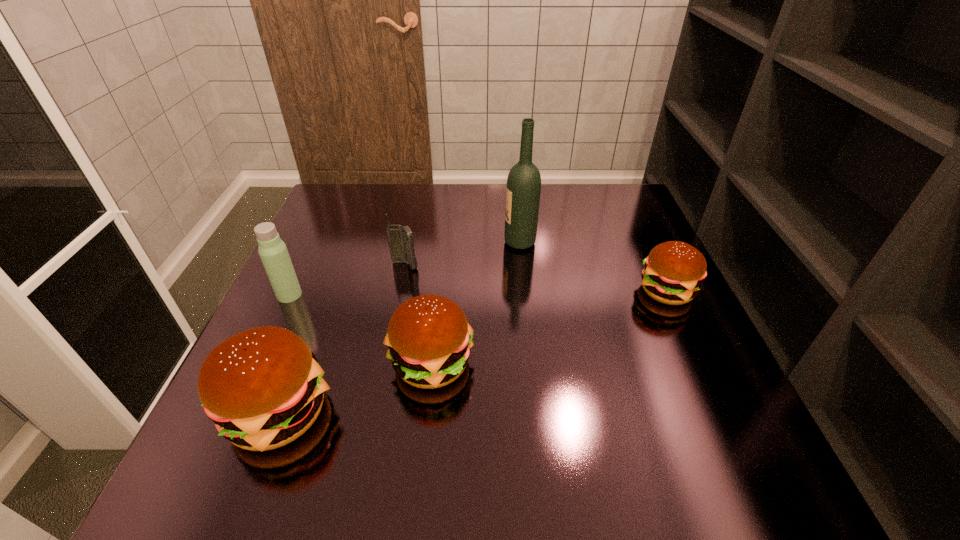
Identify the location of vacant space located on the left of the rightmost hamburger. (462, 291).

Locate an element on the screen. The image size is (960, 540). free space located 0.310m on the front of the thermos bottle is located at coordinates (225, 431).

Where is `vacant space located 0.050m on the labeled side of the farthest object`? vacant space located 0.050m on the labeled side of the farthest object is located at coordinates (485, 242).

This screenshot has width=960, height=540. I want to click on vacant region located 0.260m on the labeled side of the farthest object, so click(x=404, y=242).

You are a GUI agent. You are given a task and a screenshot of the screen. Output one action in this format:
    pyautogui.click(x=<x>, y=<y>)
    Task: Click on the vacant region located on the labeled side of the farthest object
    The image size is (960, 540).
    Given the screenshot: What is the action you would take?
    pyautogui.click(x=420, y=242)

This screenshot has height=540, width=960. Identify the location of vacant space located on the keyboard of the cellular telephone. (391, 338).

Identify the location of hamburger positioned at the left edge. The image size is (960, 540). (263, 388).

The image size is (960, 540). I want to click on thermos bottle that is at the left edge, so click(x=273, y=252).

Identify the location of object situated at the right edge. (673, 271).

Locate an element on the screen. object located in the near left corner section of the desktop is located at coordinates (263, 388).